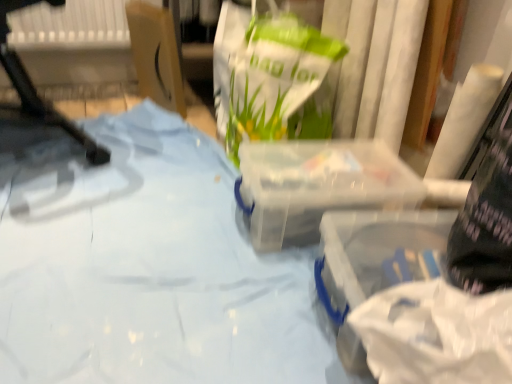
Question: From the image's perspective, does white plastic chair at left appear lower than blue fabric at center?

Choices:
 (A) yes
 (B) no

Answer: (B)

Question: Considering the relative sizes of white plastic chair at left and blue fabric at center in the image provided, is white plastic chair at left thinner than blue fabric at center?

Choices:
 (A) no
 (B) yes

Answer: (B)

Question: Can you confirm if white plastic chair at left is taller than blue fabric at center?

Choices:
 (A) yes
 (B) no

Answer: (A)

Question: Can you confirm if white plastic chair at left is shorter than blue fabric at center?

Choices:
 (A) yes
 (B) no

Answer: (B)

Question: Is white plastic chair at left surrounding blue fabric at center?

Choices:
 (A) yes
 (B) no

Answer: (B)

Question: Is cardboard box at upper left taller or shorter than transparent plastic container at center, which is the first box in back-to-front order?

Choices:
 (A) tall
 (B) short

Answer: (A)

Question: From the image's perspective, is cardboard box at upper left positioned above or below transparent plastic container at center, arranged as the 2th box when viewed from the front?

Choices:
 (A) above
 (B) below

Answer: (A)

Question: Considering the relative positions of cardboard box at upper left and transparent plastic container at center, arranged as the 2th box when viewed from the front, in the image provided, is cardboard box at upper left to the left or to the right of transparent plastic container at center, arranged as the 2th box when viewed from the front,?

Choices:
 (A) right
 (B) left

Answer: (B)

Question: Do you think cardboard box at upper left is within transparent plastic container at center, which is the first box in back-to-front order, or outside of it?

Choices:
 (A) outside
 (B) inside

Answer: (A)

Question: In the image, is transparent plastic container at lower right, marked as the second box in a back-to-front arrangement, positioned in front of or behind transparent plastic container at center, which is the first box in back-to-front order?

Choices:
 (A) front
 (B) behind

Answer: (A)

Question: Visually, is transparent plastic container at lower right, marked as the second box in a back-to-front arrangement, positioned to the left or to the right of transparent plastic container at center, which is the first box in back-to-front order?

Choices:
 (A) left
 (B) right

Answer: (B)

Question: Looking at the image, does transparent plastic container at lower right, which is counted as the first box, starting from the front, seem bigger or smaller compared to transparent plastic container at center, arranged as the 2th box when viewed from the front?

Choices:
 (A) big
 (B) small

Answer: (A)

Question: From the image's perspective, is transparent plastic container at lower right, marked as the second box in a back-to-front arrangement, located above or below transparent plastic container at center, arranged as the 2th box when viewed from the front?

Choices:
 (A) below
 (B) above

Answer: (A)

Question: From the image's perspective, is cardboard box at upper left positioned above or below blue fabric at center?

Choices:
 (A) below
 (B) above

Answer: (B)

Question: Does point (157, 34) appear closer or farther from the camera than point (188, 367)?

Choices:
 (A) farther
 (B) closer

Answer: (A)